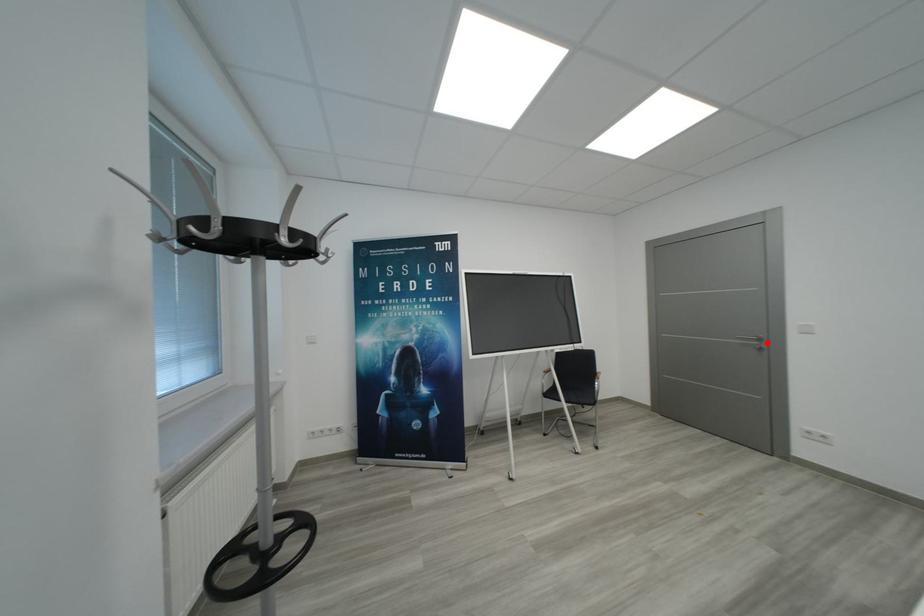
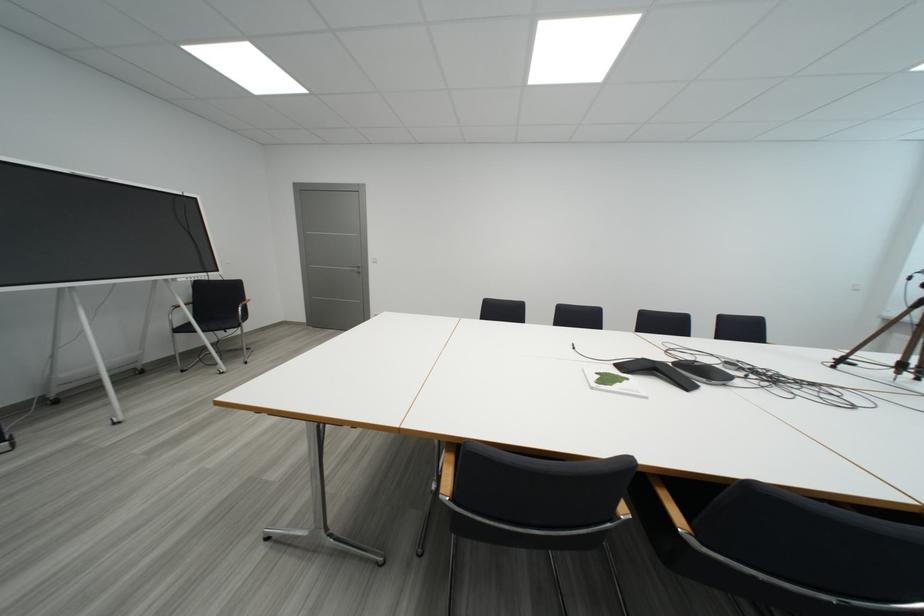
Question: I am providing you with two images of the same scene from different viewpoints. In image1, a red point is highlighted. Considering the same 3D point in image2, which of the following is correct?

Choices:
 (A) It is closer
 (B) It is farther

Answer: (B)